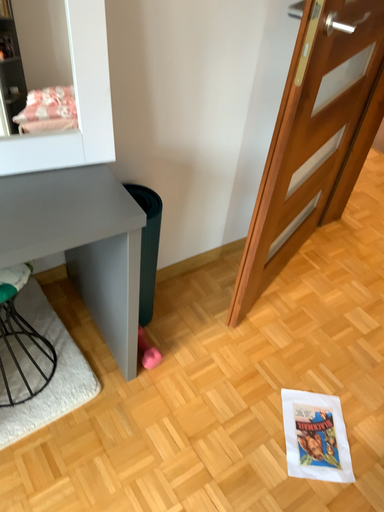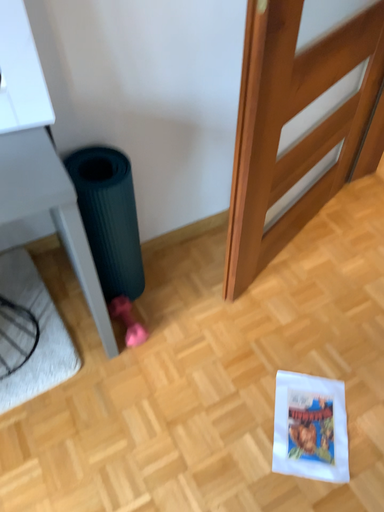
Question: Which way did the camera rotate in the video?

Choices:
 (A) rotated downward
 (B) rotated upward

Answer: (A)